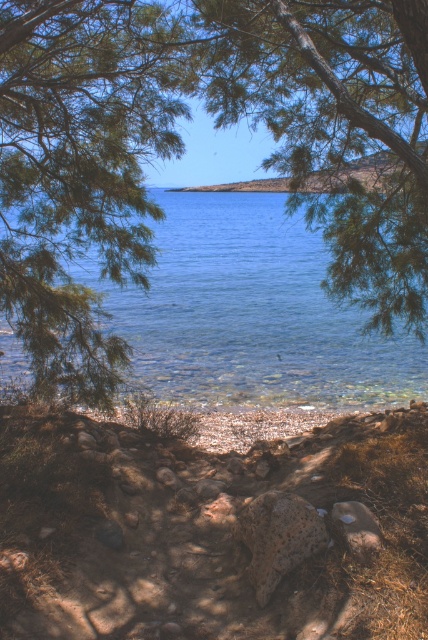
You are standing on the rocky ground and want to reach the clear blue water at center. Is the brown rough stone at center blocking your path to the water?

The brown rough stone at center is behind the clear blue water at center, so it is not blocking your path to the water. You can reach the clear blue water at center without any obstruction from the brown rough stone at center.

You are standing at the center of the image and want to walk towards the green leafy tree at center. Which direction should you move?

Since the green leafy tree at center is located at point (336,129), you should move towards the lower left direction to reach it.

Looking at this image, you are standing at the base of the pine tree in the coastal scene and want to walk to the point marked as point (315, 129) and point (335, 525). Which point will you reach first?

You will reach point (315, 129) first because it is closer to you than point (335, 525), which is further away.